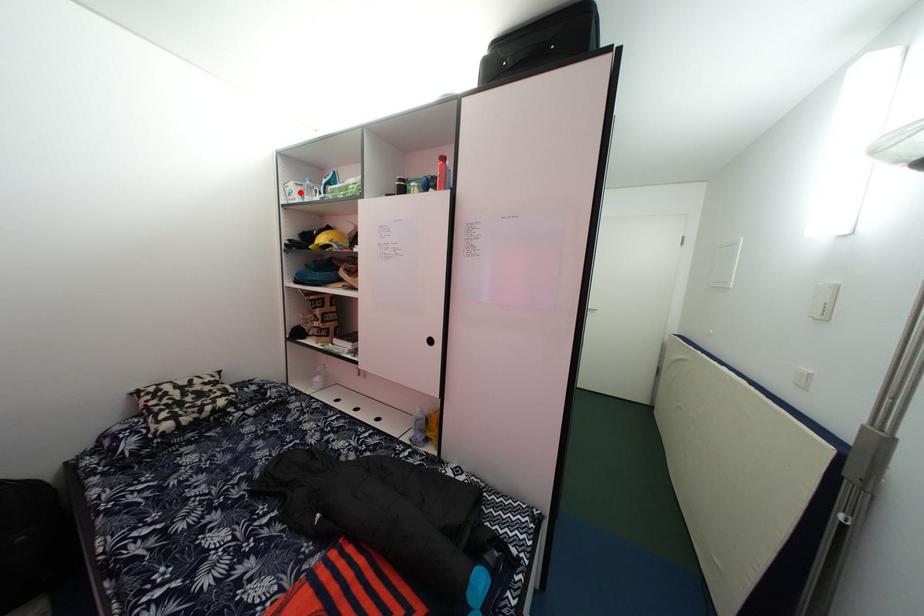
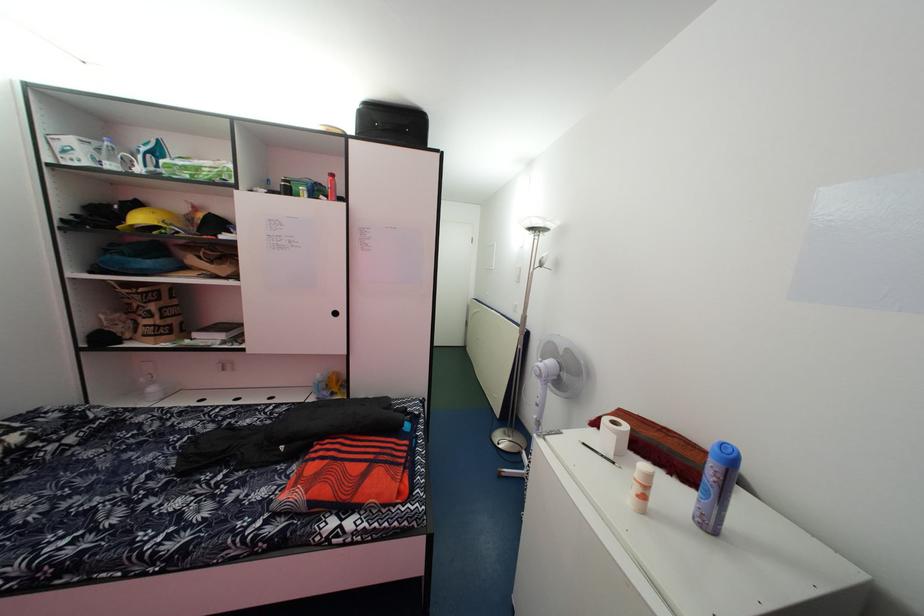
Question: I am providing you with two images of the same scene from different viewpoints. Given a red point in image1, look at the same physical point in image2. Is it:

Choices:
 (A) Closer to the viewpoint
 (B) Farther from the viewpoint

Answer: (B)